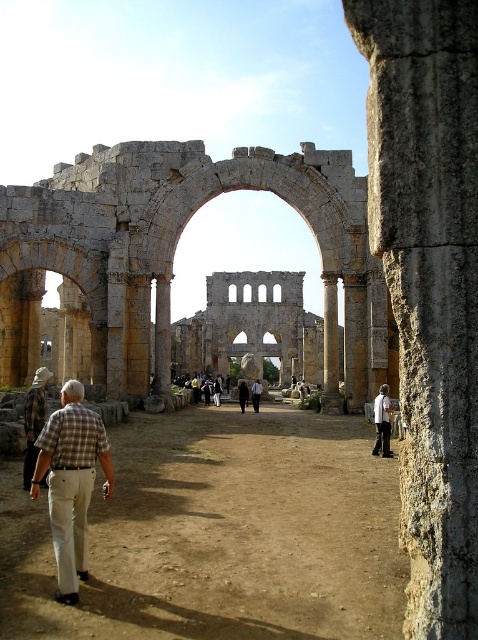
Question: Which object is closer to the camera taking this photo?

Choices:
 (A) white cotton shirt at center
 (B) stone archway at center
 (C) plaid shirt at lower left

Answer: (C)

Question: Which object is the farthest from the plaid shirt at lower left?

Choices:
 (A) stone archway at center
 (B) gray stone column at center

Answer: (A)

Question: Does plaid shirt at lower left come in front of black fabric person at center?

Choices:
 (A) no
 (B) yes

Answer: (B)

Question: Which object is the farthest from the gray stone column at center?

Choices:
 (A) stone archway at center
 (B) black fabric person at center
 (C) dark brown leather jacket at center
 (D) plaid shirt at lower left

Answer: (B)

Question: Observing the image, what is the correct spatial positioning of plaid shirt at lower left in reference to white cotton shirt at center?

Choices:
 (A) above
 (B) below

Answer: (B)

Question: Does gray stone column at center lie in front of plaid shirt at lower left?

Choices:
 (A) no
 (B) yes

Answer: (B)